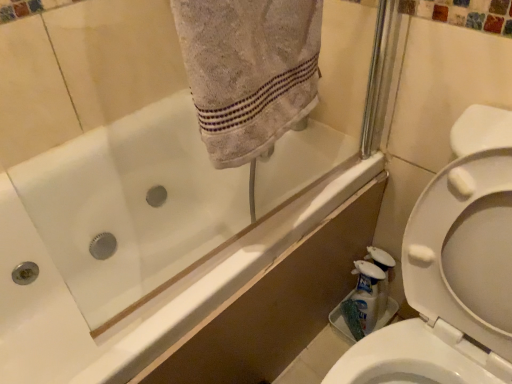
Image resolution: width=512 pixels, height=384 pixels. What do you see at coordinates (248, 70) in the screenshot?
I see `gray cotton towel at upper center` at bounding box center [248, 70].

The height and width of the screenshot is (384, 512). Describe the element at coordinates (362, 299) in the screenshot. I see `white plastic bottle at lower right, placed as the 2th cleaning product when sorted from right to left` at that location.

Identify the location of white glossy bottle at lower right, the 2th cleaning product in the left-to-right sequence. The height and width of the screenshot is (384, 512). (384, 273).

Identify the location of gray cotton towel at upper center. point(248,70).

Who is bigger, white glossy bottle at lower right, which is the 1th cleaning product from right to left, or gray cotton towel at upper center?

gray cotton towel at upper center is bigger.

Is white glossy bottle at lower right, which is the 1th cleaning product from right to left, in front of or behind gray cotton towel at upper center in the image?

Visually, white glossy bottle at lower right, which is the 1th cleaning product from right to left, is located behind gray cotton towel at upper center.

From a real-world perspective, is white glossy bottle at lower right, the 2th cleaning product in the left-to-right sequence, physically below gray cotton towel at upper center?

Yes, from a real-world perspective, white glossy bottle at lower right, the 2th cleaning product in the left-to-right sequence, is under gray cotton towel at upper center.

From the image's perspective, is white glossy bottle at lower right, which is the 1th cleaning product from right to left, above gray cotton towel at upper center?

No, from the image's perspective, white glossy bottle at lower right, which is the 1th cleaning product from right to left, is not on top of gray cotton towel at upper center.

Which object is closer to the camera taking this photo, white glossy bottle at lower right, the 2th cleaning product in the left-to-right sequence, or white plastic bottle at lower right, placed as the 2th cleaning product when sorted from right to left?

white plastic bottle at lower right, placed as the 2th cleaning product when sorted from right to left, is more forward.

Considering the relative sizes of white glossy bottle at lower right, which is the 1th cleaning product from right to left, and white plastic bottle at lower right, placed as the first cleaning product when sorted from left to right, in the image provided, is white glossy bottle at lower right, which is the 1th cleaning product from right to left, bigger than white plastic bottle at lower right, placed as the first cleaning product when sorted from left to right,?

Yes.

Is white glossy bottle at lower right, the 2th cleaning product in the left-to-right sequence, wider than white plastic bottle at lower right, placed as the 2th cleaning product when sorted from right to left?

In fact, white glossy bottle at lower right, the 2th cleaning product in the left-to-right sequence, might be narrower than white plastic bottle at lower right, placed as the 2th cleaning product when sorted from right to left.

From a real-world perspective, relative to white plastic bottle at lower right, placed as the 2th cleaning product when sorted from right to left, is white glossy bottle at lower right, the 2th cleaning product in the left-to-right sequence, vertically above or below?

From a real-world perspective, white glossy bottle at lower right, the 2th cleaning product in the left-to-right sequence, is physically below white plastic bottle at lower right, placed as the 2th cleaning product when sorted from right to left.

From the picture: Is white glossy bathtub at upper left not near white glossy bottle at lower right, the 2th cleaning product in the left-to-right sequence?

Actually, white glossy bathtub at upper left and white glossy bottle at lower right, the 2th cleaning product in the left-to-right sequence, are a little close together.

Locate an element on the screen. The width and height of the screenshot is (512, 384). bath located above the white glossy bottle at lower right, the 2th cleaning product in the left-to-right sequence (from a real-world perspective) is located at coordinates (160, 203).

Can white glossy bottle at lower right, which is the 1th cleaning product from right to left, be found inside white glossy bathtub at upper left?

No, white glossy bathtub at upper left does not contain white glossy bottle at lower right, which is the 1th cleaning product from right to left.

Is white glossy bathtub at upper left oriented away from white glossy bottle at lower right, the 2th cleaning product in the left-to-right sequence?

No, white glossy bottle at lower right, the 2th cleaning product in the left-to-right sequence, is not at the back of white glossy bathtub at upper left.

Does white plastic bottle at lower right, placed as the 2th cleaning product when sorted from right to left, turn towards white glossy bathtub at upper left?

No, white plastic bottle at lower right, placed as the 2th cleaning product when sorted from right to left, is not aimed at white glossy bathtub at upper left.

Considering the sizes of white plastic bottle at lower right, placed as the first cleaning product when sorted from left to right, and white glossy bathtub at upper left in the image, is white plastic bottle at lower right, placed as the first cleaning product when sorted from left to right, taller or shorter than white glossy bathtub at upper left?

In the image, white plastic bottle at lower right, placed as the first cleaning product when sorted from left to right, appears to be shorter than white glossy bathtub at upper left.

Between white plastic bottle at lower right, placed as the first cleaning product when sorted from left to right, and white glossy bathtub at upper left, which one appears on the left side from the viewer's perspective?

Positioned to the left is white glossy bathtub at upper left.

Does white plastic bottle at lower right, placed as the 2th cleaning product when sorted from right to left, have a lesser height compared to white glossy bottle at lower right, which is the 1th cleaning product from right to left?

Yes, white plastic bottle at lower right, placed as the 2th cleaning product when sorted from right to left, is shorter than white glossy bottle at lower right, which is the 1th cleaning product from right to left.

Is white plastic bottle at lower right, placed as the 2th cleaning product when sorted from right to left, positioned far away from white glossy bottle at lower right, which is the 1th cleaning product from right to left?

white plastic bottle at lower right, placed as the 2th cleaning product when sorted from right to left, is near white glossy bottle at lower right, which is the 1th cleaning product from right to left, not far away.

From the image's perspective, which object appears higher, white plastic bottle at lower right, placed as the 2th cleaning product when sorted from right to left, or white glossy bottle at lower right, the 2th cleaning product in the left-to-right sequence?

white glossy bottle at lower right, the 2th cleaning product in the left-to-right sequence, from the image's perspective.

Is gray cotton towel at upper center a part of white plastic bottle at lower right, placed as the first cleaning product when sorted from left to right?

No, gray cotton towel at upper center is not surrounded by white plastic bottle at lower right, placed as the first cleaning product when sorted from left to right.

Is gray cotton towel at upper center at the back of white plastic bottle at lower right, placed as the 2th cleaning product when sorted from right to left?

white plastic bottle at lower right, placed as the 2th cleaning product when sorted from right to left, does not have its back to gray cotton towel at upper center.

Does white plastic bottle at lower right, placed as the first cleaning product when sorted from left to right, appear on the left side of gray cotton towel at upper center?

No, white plastic bottle at lower right, placed as the first cleaning product when sorted from left to right, is not to the left of gray cotton towel at upper center.

Is white glossy bottle at lower right, which is the 1th cleaning product from right to left, positioned far away from white glossy bathtub at upper left?

No, white glossy bottle at lower right, which is the 1th cleaning product from right to left, is in close proximity to white glossy bathtub at upper left.

Does white glossy bottle at lower right, the 2th cleaning product in the left-to-right sequence, have a greater width compared to white glossy bathtub at upper left?

Incorrect, the width of white glossy bottle at lower right, the 2th cleaning product in the left-to-right sequence, does not surpass that of white glossy bathtub at upper left.

Which of these two, white glossy bottle at lower right, the 2th cleaning product in the left-to-right sequence, or white glossy bathtub at upper left, stands taller?

Standing taller between the two is white glossy bathtub at upper left.

Considering the relative sizes of white glossy bottle at lower right, which is the 1th cleaning product from right to left, and white glossy bathtub at upper left in the image provided, is white glossy bottle at lower right, which is the 1th cleaning product from right to left, bigger than white glossy bathtub at upper left?

Incorrect, white glossy bottle at lower right, which is the 1th cleaning product from right to left, is not larger than white glossy bathtub at upper left.

Find the location of a particular element. The width and height of the screenshot is (512, 384). bath towel in front of the white glossy bottle at lower right, which is the 1th cleaning product from right to left is located at coordinates pos(248,70).

Image resolution: width=512 pixels, height=384 pixels. What are the coordinates of `cleaning product behind the white plastic bottle at lower right, placed as the 2th cleaning product when sorted from right to left` in the screenshot? It's located at (384, 273).

Looking at the image, which one is located closer to gray cotton towel at upper center, white glossy bottle at lower right, which is the 1th cleaning product from right to left, or white glossy bathtub at upper left?

white glossy bathtub at upper left lies closer to gray cotton towel at upper center than the other object.

When comparing their distances from white glossy bathtub at upper left, does gray cotton towel at upper center or white glossy bottle at lower right, which is the 1th cleaning product from right to left, seem further?

Based on the image, white glossy bottle at lower right, which is the 1th cleaning product from right to left, appears to be further to white glossy bathtub at upper left.

Estimate the real-world distances between objects in this image. Which object is closer to gray cotton towel at upper center, white plastic bottle at lower right, placed as the 2th cleaning product when sorted from right to left, or white glossy bathtub at upper left?

Based on the image, white glossy bathtub at upper left appears to be nearer to gray cotton towel at upper center.

When comparing their distances from gray cotton towel at upper center, does white plastic bottle at lower right, placed as the first cleaning product when sorted from left to right, or white glossy bottle at lower right, the 2th cleaning product in the left-to-right sequence, seem further?

Among the two, white glossy bottle at lower right, the 2th cleaning product in the left-to-right sequence, is located further to gray cotton towel at upper center.

From the image, which object appears to be farther from white glossy bottle at lower right, which is the 1th cleaning product from right to left, gray cotton towel at upper center or white plastic bottle at lower right, placed as the 2th cleaning product when sorted from right to left?

gray cotton towel at upper center.

From the image, which object appears to be farther from white glossy bathtub at upper left, gray cotton towel at upper center or white plastic bottle at lower right, placed as the first cleaning product when sorted from left to right?

Based on the image, gray cotton towel at upper center appears to be further to white glossy bathtub at upper left.

From the image, which object appears to be farther from white plastic bottle at lower right, placed as the first cleaning product when sorted from left to right, white glossy bathtub at upper left or white glossy bottle at lower right, the 2th cleaning product in the left-to-right sequence?

The object further to white plastic bottle at lower right, placed as the first cleaning product when sorted from left to right, is white glossy bathtub at upper left.

When comparing their distances from gray cotton towel at upper center, does white glossy bathtub at upper left or white glossy bottle at lower right, the 2th cleaning product in the left-to-right sequence, seem further?

white glossy bottle at lower right, the 2th cleaning product in the left-to-right sequence, is further to gray cotton towel at upper center.

In order to click on cleaning product between white glossy bathtub at upper left and white glossy bottle at lower right, the 2th cleaning product in the left-to-right sequence, in the front-back direction in this screenshot , I will do `click(362, 299)`.

Where is `bath towel between white glossy bathtub at upper left and white glossy bottle at lower right, which is the 1th cleaning product from right to left, from front to back`? The image size is (512, 384). bath towel between white glossy bathtub at upper left and white glossy bottle at lower right, which is the 1th cleaning product from right to left, from front to back is located at coordinates (248, 70).

Locate an element on the screen. bath towel between white glossy bathtub at upper left and white plastic bottle at lower right, placed as the first cleaning product when sorted from left to right, along the z-axis is located at coordinates (248, 70).

Image resolution: width=512 pixels, height=384 pixels. Identify the location of cleaning product located between gray cotton towel at upper center and white glossy bottle at lower right, the 2th cleaning product in the left-to-right sequence, in the depth direction. (362, 299).